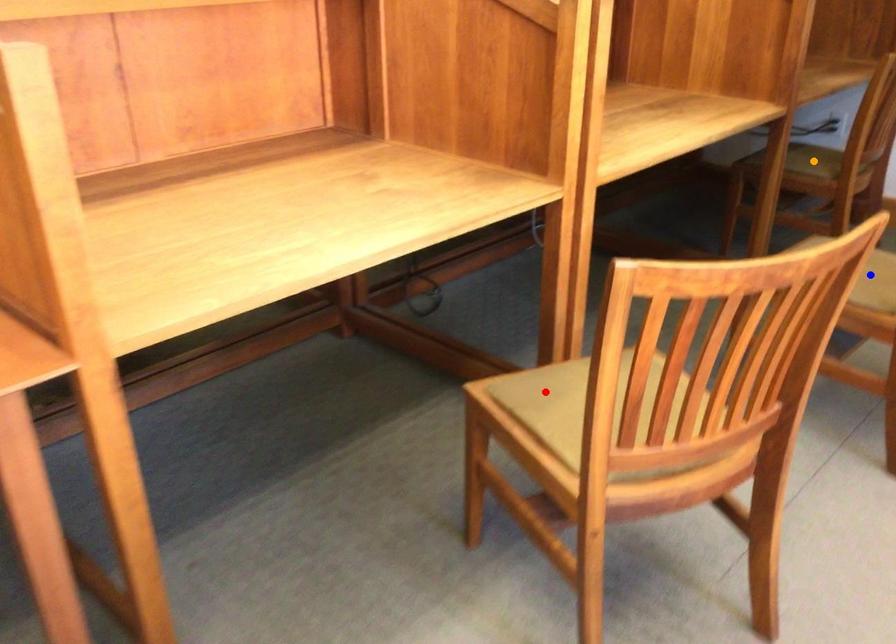
Order these from nearest to farthest:
orange point, red point, blue point

red point, blue point, orange point